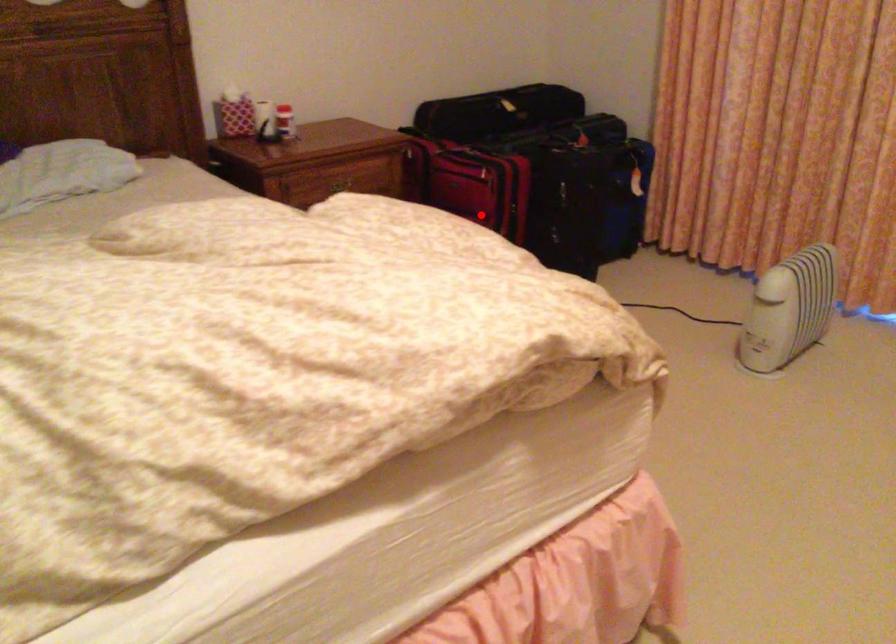
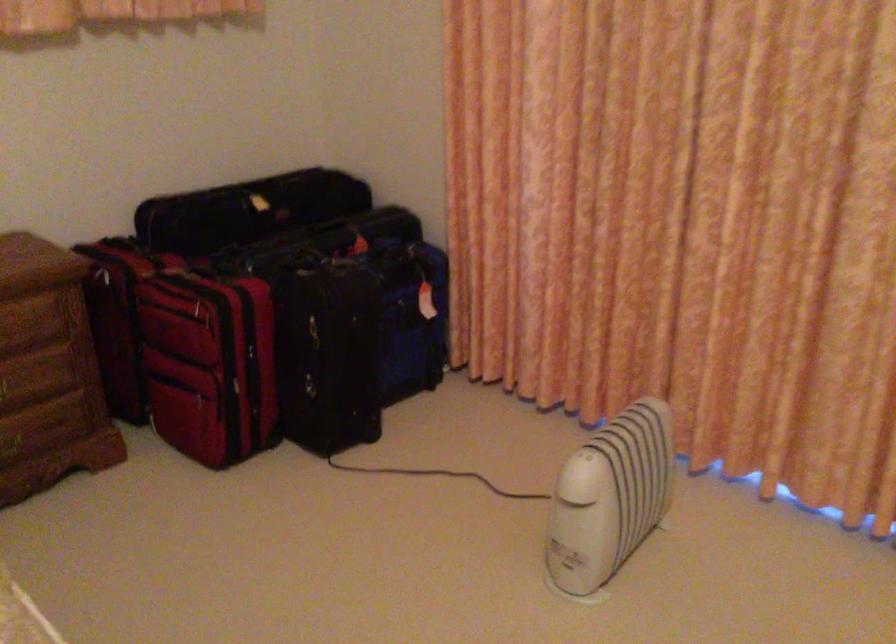
Where in the second image is the point corresponding to the highlighted location from the first image?

(209, 364)